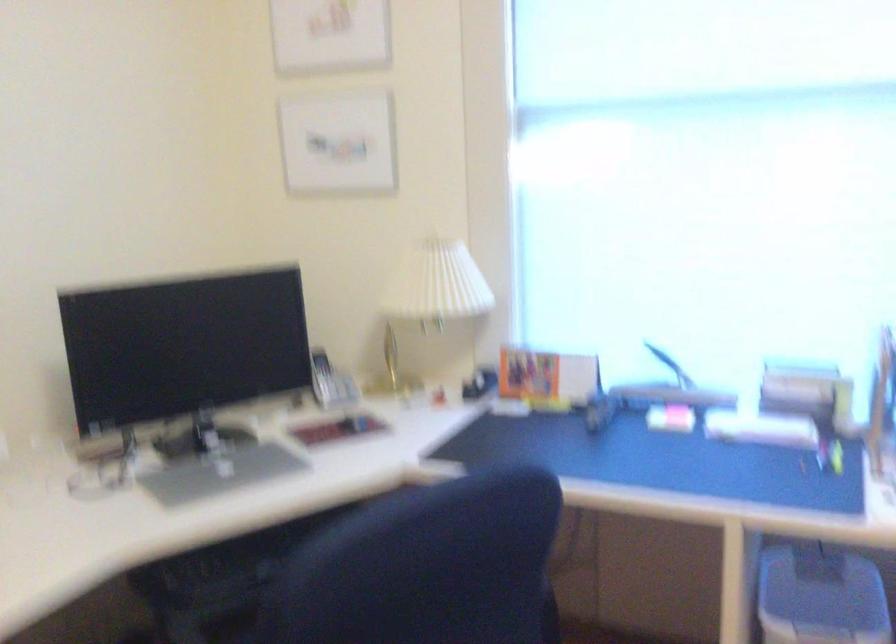
What do you see at coordinates (479, 383) in the screenshot? I see `the black stapler` at bounding box center [479, 383].